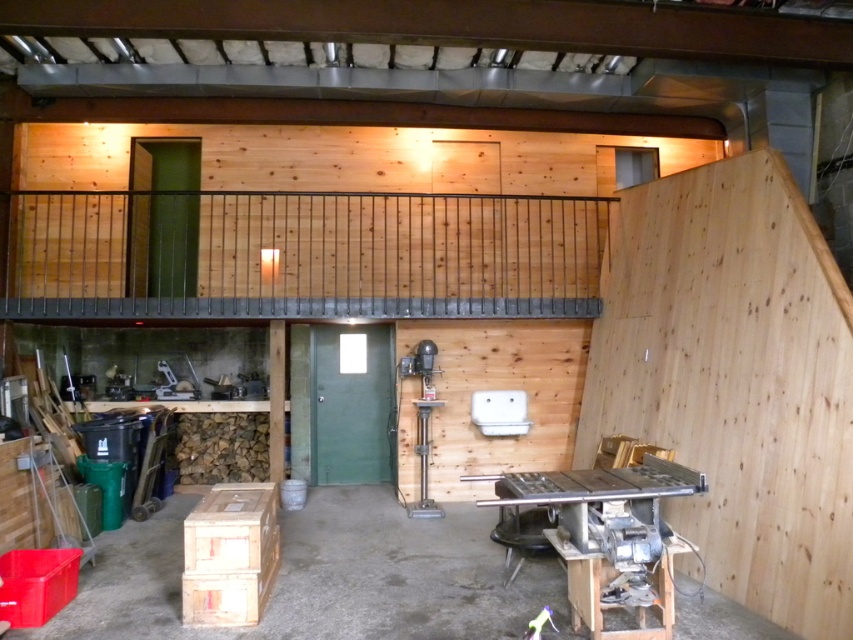
You are organizing a workshop and need to place a tall plant that requires a stable base. The plant is taller than both the wooden crate at lower left and the metallic gray table at lower right. Which object should you place the plant on to ensure stability?

The metallic gray table at lower right is taller than the wooden crate at lower left, so placing the plant on the metallic gray table at lower right would provide a more stable base since it can support the plant without tipping over due to its height advantage.

You are organizing a tool inventory in the workshop. You have a wooden crate at lower left and a metallic gray table at lower right. Which object should you place a large tool box on to ensure it fits properly?

The wooden crate at lower left is wider than the metallic gray table at lower right, so placing the large tool box on the wooden crate at lower left would ensure it fits properly.